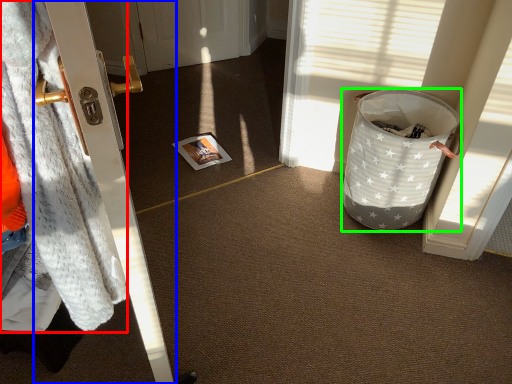
Question: Which object is positioned closest to blanket (highlighted by a red box)? Select from door (highlighted by a blue box) and trash bin/can (highlighted by a green box).

Choices:
 (A) door
 (B) trash bin/can

Answer: (A)